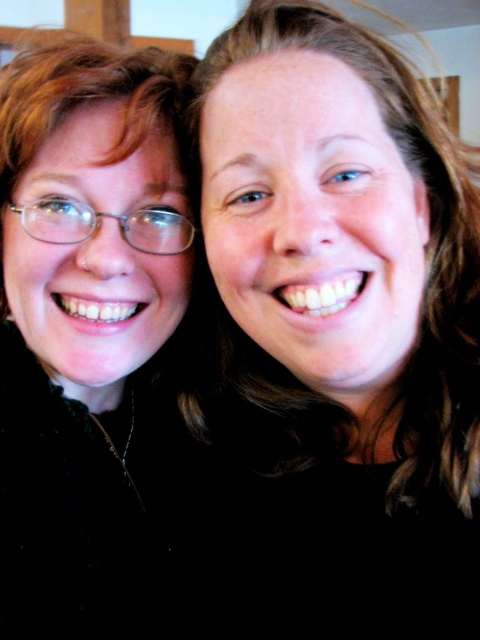
Does matte black hair at center appear over matte black glasses at left?

Correct, matte black hair at center is located above matte black glasses at left.

Which is more to the left, matte black hair at center or matte black glasses at left?

Positioned to the left is matte black glasses at left.

Where is `matte black hair at center`? This screenshot has width=480, height=640. matte black hair at center is located at coordinates (342, 328).